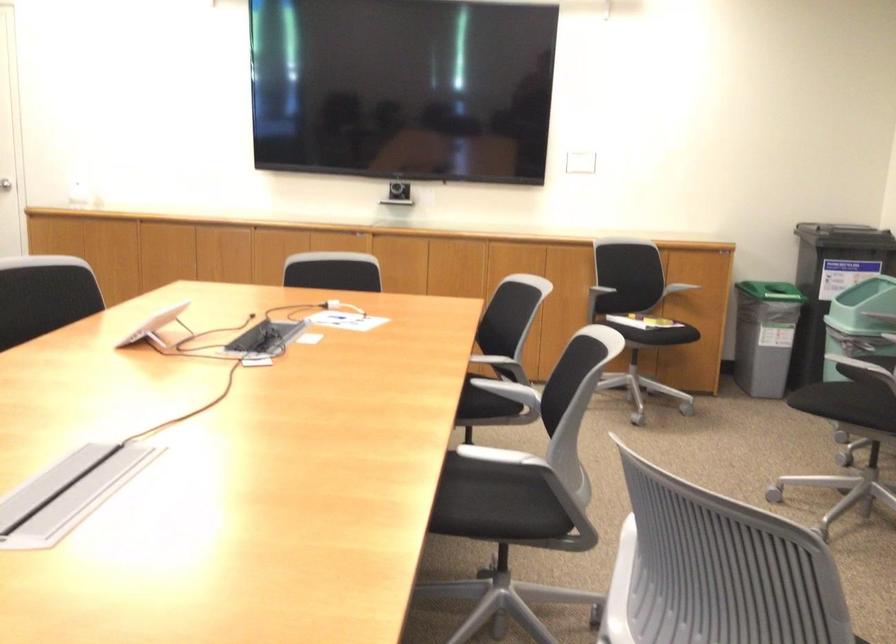
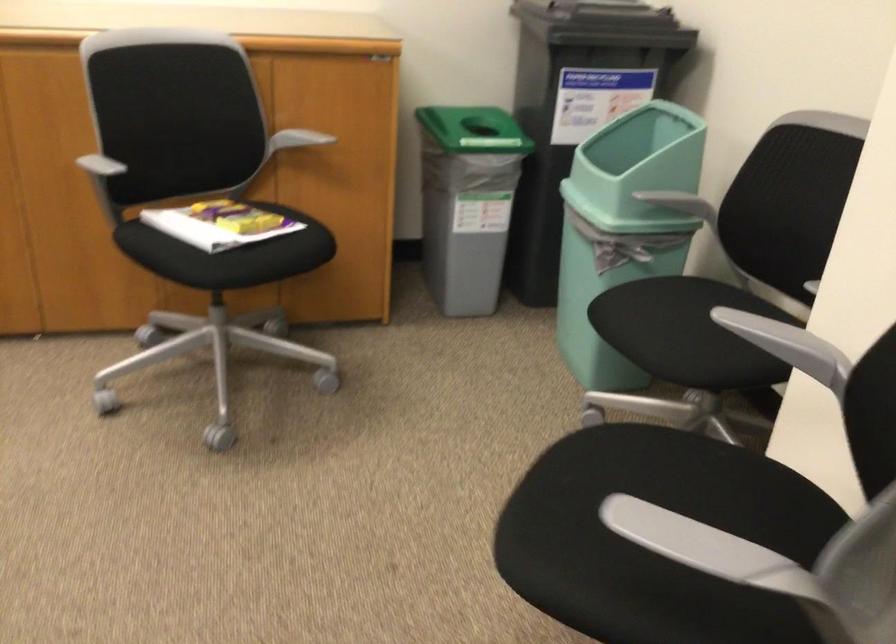
Which direction would the cameraman need to move to produce the second image?

The cameraman walked toward right, forward.